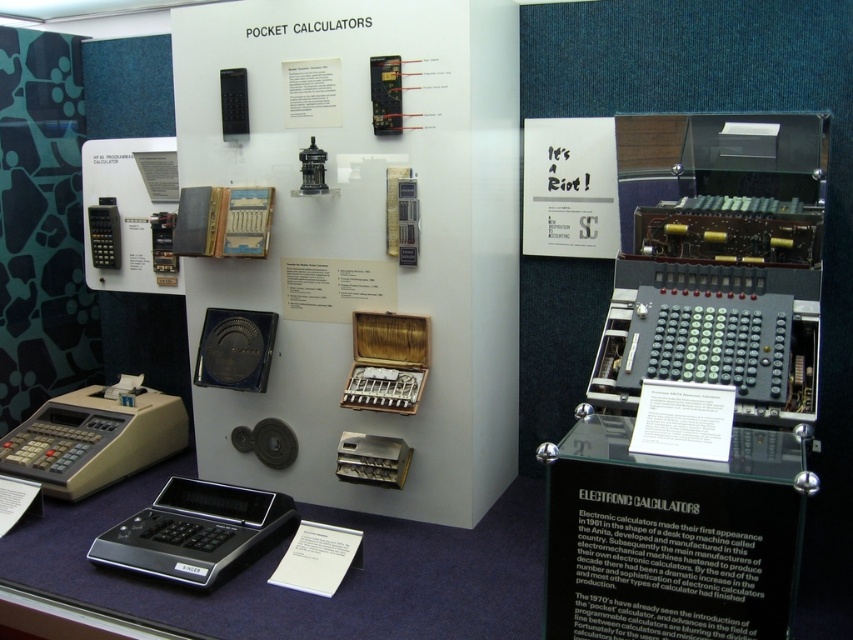
What object is located at the coordinates point (94, 436) in the image?

The beige plastic cash register at lower left is located at point (94, 436).

You are a visitor at the museum exhibit and want to take a photo of both the beige plastic cash register at lower left and the black plastic calculator at lower left. Which object should you focus on first to ensure both are in the frame?

You should focus on the beige plastic cash register at lower left first because it is closer to you than the black plastic calculator at lower left, ensuring both are in the frame.

You are a museum visitor holding a 12 cm wide box. You need to place it on the display shelf between the beige plastic cash register at lower left and the black plastic calculator at lower left. Can the box fit between them based on their widths?

The beige plastic cash register at lower left is wider than the black plastic calculator at lower left. Since the box is 12 cm wide, we need to know the exact width difference between the two items to determine if the space between them can accommodate the box. However, the provided information only states that the beige cash register is wider, but does not specify the exact width difference. Therefore, it is uncertain if the 12 cm box will fit without additional measurements.